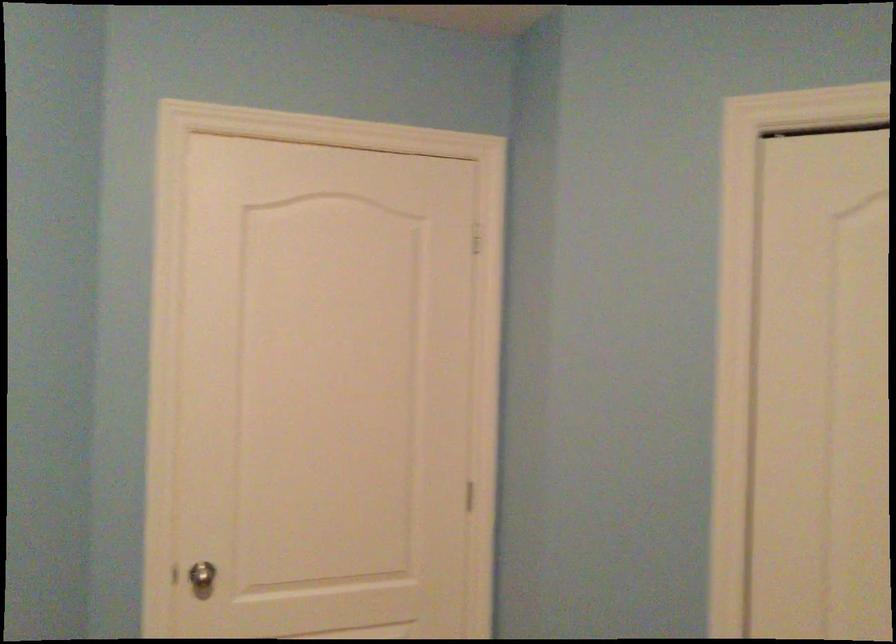
Locate an element on the screen. The image size is (896, 644). metal doorknob is located at coordinates pos(202,578).